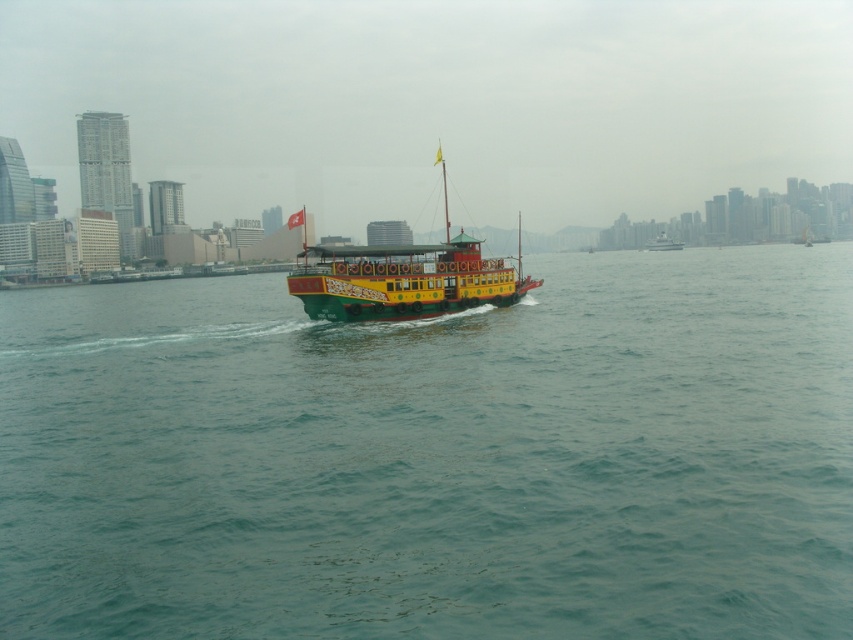
You are standing on the ferry boat and want to walk from the point at coordinate point (x=509, y=586) to the point at coordinate point (x=666, y=244). Which direction should you move to reach your destination?

To move from point (x=509, y=586) to point (x=666, y=244), you should move towards the direction of the cityscape in the background since point (x=666, y=244) is behind point (x=509, y=586).